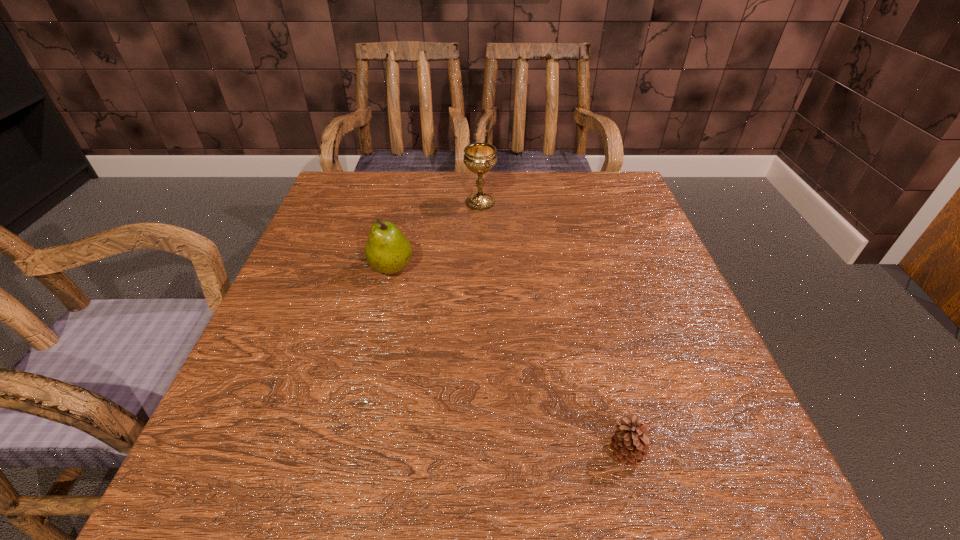
The image size is (960, 540). Identify the location of the farthest object. (479, 158).

This screenshot has width=960, height=540. I want to click on chalice, so click(479, 158).

The image size is (960, 540). In order to click on pear in this screenshot , I will do `click(387, 250)`.

Identify the location of the leftmost object. (387, 250).

This screenshot has height=540, width=960. I want to click on pinecone, so click(630, 445).

Where is `the nearest object`? the nearest object is located at coordinates click(630, 445).

Where is `vacant area located 0.250m on the right of the farthest object`? The image size is (960, 540). vacant area located 0.250m on the right of the farthest object is located at coordinates (597, 203).

Where is `vacant space located 0.330m on the back of the pear`? This screenshot has width=960, height=540. vacant space located 0.330m on the back of the pear is located at coordinates (412, 177).

The width and height of the screenshot is (960, 540). Find the location of `vacant position located on the back of the shortest object`. vacant position located on the back of the shortest object is located at coordinates (591, 318).

Locate an element on the screen. The width and height of the screenshot is (960, 540). object present at the far edge is located at coordinates (479, 158).